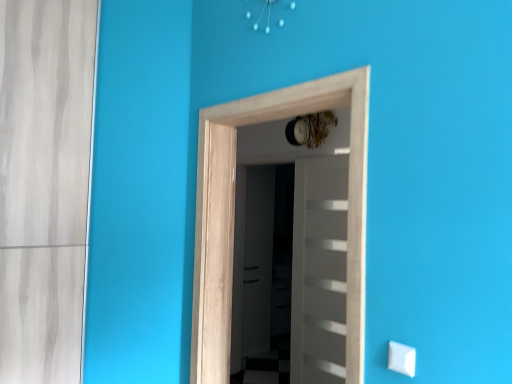
Question: Does white glossy door at center, positioned as the first door in back-to-front order, lie behind natural wood door at center, the 2th door when ordered from back to front?

Choices:
 (A) yes
 (B) no

Answer: (A)

Question: Considering the relative sizes of white glossy door at center, acting as the second door starting from the front, and natural wood door at center, which ranks as the first door in front-to-back order, in the image provided, is white glossy door at center, acting as the second door starting from the front, bigger than natural wood door at center, which ranks as the first door in front-to-back order,?

Choices:
 (A) yes
 (B) no

Answer: (B)

Question: Is white glossy door at center, acting as the second door starting from the front, oriented towards natural wood door at center, which ranks as the first door in front-to-back order?

Choices:
 (A) yes
 (B) no

Answer: (B)

Question: Is natural wood door at center, the 2th door when ordered from back to front, at the back of white glossy door at center, positioned as the first door in back-to-front order?

Choices:
 (A) yes
 (B) no

Answer: (B)

Question: Can you confirm if white glossy door at center, positioned as the first door in back-to-front order, is smaller than natural wood door at center, the 2th door when ordered from back to front?

Choices:
 (A) yes
 (B) no

Answer: (A)

Question: Considering the positions of transparent glass screen door at center and natural wood door at center, which ranks as the first door in front-to-back order, in the image, is transparent glass screen door at center taller or shorter than natural wood door at center, which ranks as the first door in front-to-back order,?

Choices:
 (A) tall
 (B) short

Answer: (A)

Question: Is point (247, 168) closer or farther from the camera than point (367, 82)?

Choices:
 (A) farther
 (B) closer

Answer: (A)

Question: Which is correct: transparent glass screen door at center is inside natural wood door at center, the 2th door when ordered from back to front, or outside of it?

Choices:
 (A) inside
 (B) outside

Answer: (B)

Question: From a real-world perspective, relative to natural wood door at center, which ranks as the first door in front-to-back order, is transparent glass screen door at center vertically above or below?

Choices:
 (A) above
 (B) below

Answer: (B)

Question: From a real-world perspective, is natural wood door at center, the 2th door when ordered from back to front, positioned above or below white plastic light switch at lower right?

Choices:
 (A) above
 (B) below

Answer: (A)

Question: Based on their sizes in the image, would you say natural wood door at center, which ranks as the first door in front-to-back order, is bigger or smaller than white plastic light switch at lower right?

Choices:
 (A) small
 (B) big

Answer: (B)

Question: Is natural wood door at center, which ranks as the first door in front-to-back order, wider or thinner than white plastic light switch at lower right?

Choices:
 (A) thin
 (B) wide

Answer: (B)

Question: Is natural wood door at center, which ranks as the first door in front-to-back order, taller or shorter than white plastic light switch at lower right?

Choices:
 (A) tall
 (B) short

Answer: (A)

Question: Which is correct: white glossy door at center, positioned as the first door in back-to-front order, is inside natural wood door at center, the 2th door when ordered from back to front, or outside of it?

Choices:
 (A) inside
 (B) outside

Answer: (B)

Question: Looking at the image, does white glossy door at center, acting as the second door starting from the front, seem bigger or smaller compared to natural wood door at center, which ranks as the first door in front-to-back order?

Choices:
 (A) small
 (B) big

Answer: (A)